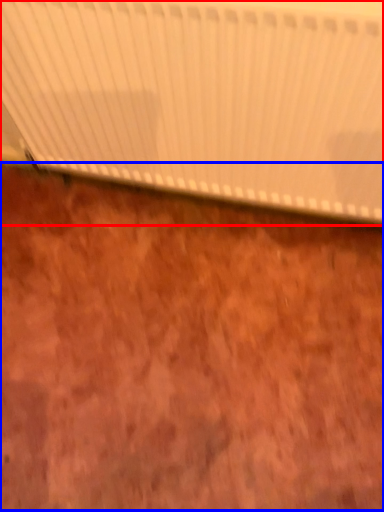
Question: Which object is further to the camera taking this photo, curtain (highlighted by a red box) or plywood (highlighted by a blue box)?

Choices:
 (A) curtain
 (B) plywood

Answer: (B)